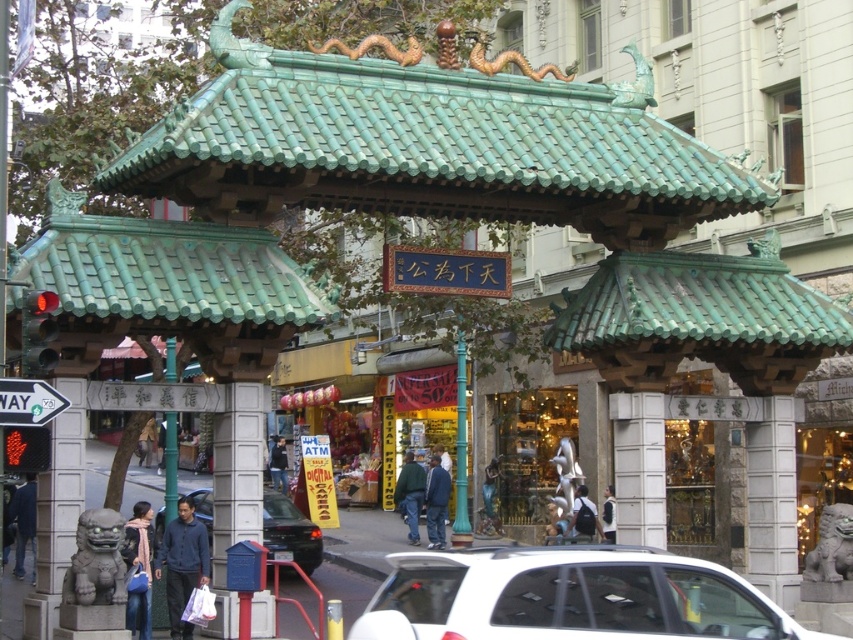
Question: Which object appears closest to the camera in this image?

Choices:
 (A) dark blue shirt at lower left
 (B) green painted metal pole at center

Answer: (A)

Question: Does blue denim jacket at lower left have a larger size compared to dark blue shirt at center?

Choices:
 (A) yes
 (B) no

Answer: (A)

Question: Does metallic gray sedan at center have a larger size compared to green fabric jacket at center?

Choices:
 (A) no
 (B) yes

Answer: (B)

Question: Which of the following is the closest to the observer?

Choices:
 (A) green painted metal pole at center
 (B) blue jeans at center

Answer: (A)

Question: Can you confirm if light pink scarf at center is positioned above white cotton shirt at center?

Choices:
 (A) no
 (B) yes

Answer: (B)

Question: Among these objects, which one is farthest from the camera?

Choices:
 (A) dark blue shirt at lower left
 (B) light pink scarf at center
 (C) dark blue shirt at center

Answer: (C)